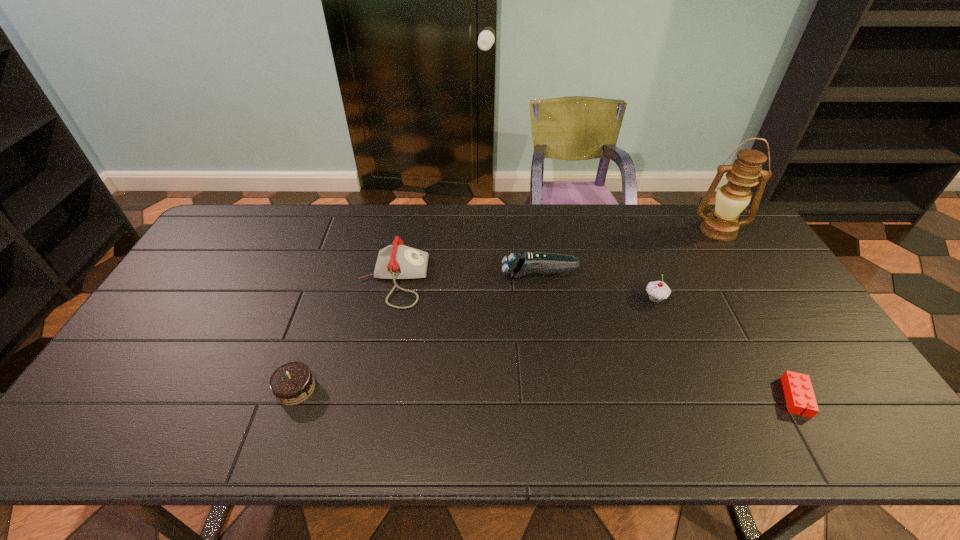
Where is `free space that satisfies the following two spatial constraints: 1. on the back side of the oil lamp; 2. on the right side of the shortest object`? The width and height of the screenshot is (960, 540). free space that satisfies the following two spatial constraints: 1. on the back side of the oil lamp; 2. on the right side of the shortest object is located at coordinates (700, 231).

Find the location of a particular element. The height and width of the screenshot is (540, 960). vacant space that satisfies the following two spatial constraints: 1. on the head of the third object from right to left; 2. on the right side of the electric shaver is located at coordinates (542, 299).

Where is `free location that satisfies the following two spatial constraints: 1. on the head of the fourth object from right to left; 2. on the right side of the Lego`? free location that satisfies the following two spatial constraints: 1. on the head of the fourth object from right to left; 2. on the right side of the Lego is located at coordinates (556, 397).

This screenshot has height=540, width=960. What are the coordinates of `vacant region that satisfies the following two spatial constraints: 1. on the dial of the telephone; 2. on the left side of the shortest object` in the screenshot? It's located at (x=369, y=397).